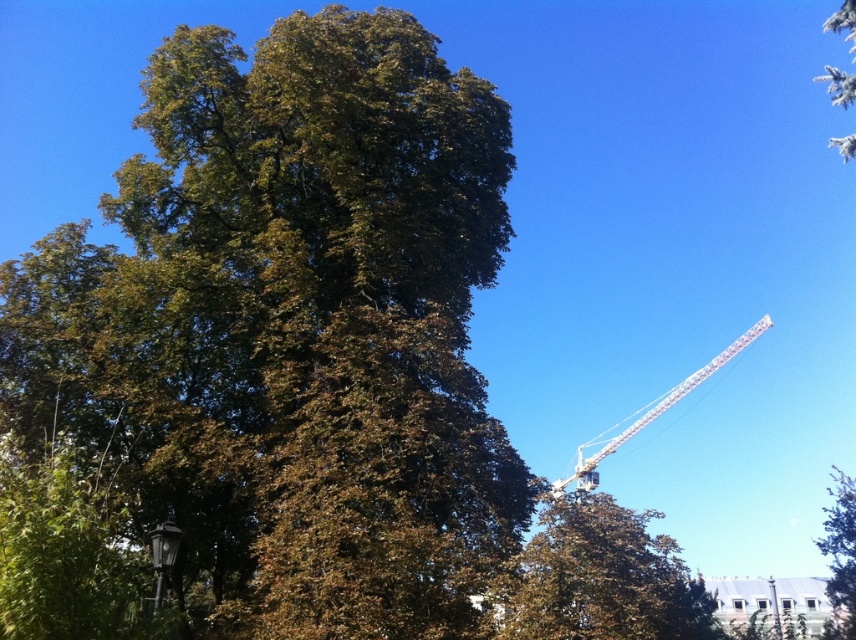
You are standing in the middle of the image and want to walk towards the white metallic crane at upper right. Which direction should you move relative to the green leafy tree at upper center?

Since the green leafy tree at upper center is to the left of the white metallic crane at upper right, you should move towards the right relative to the green leafy tree at upper center to reach the white metallic crane at upper right.

You are standing at the base of the green leafy tree at upper center and want to throw a ball to reach the white fluffy snow at upper right. If the ball can travel 16 meters, will it reach the snow?

The green leafy tree at upper center is 15.93 meters away from the white fluffy snow at upper right. Since the ball can travel 16 meters, it will just barely reach the snow.